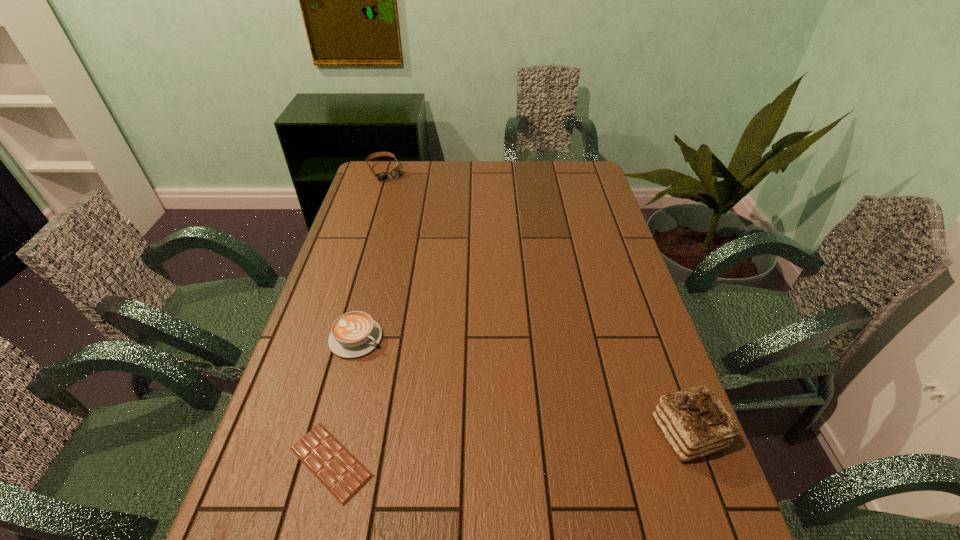
Where is `chocolate bar`? chocolate bar is located at coordinates (343, 475).

The width and height of the screenshot is (960, 540). Identify the location of the rightmost object. (694, 422).

Image resolution: width=960 pixels, height=540 pixels. What are the coordinates of `the tallest object` in the screenshot? It's located at [694, 422].

Where is `the second farthest object`? the second farthest object is located at coordinates (353, 334).

The image size is (960, 540). Find the location of `goggles`. goggles is located at coordinates (396, 172).

Image resolution: width=960 pixels, height=540 pixels. I want to click on vacant area situated on the back of the shortest object, so click(x=372, y=295).

This screenshot has height=540, width=960. Find the location of `vacant space located 0.130m on the back of the tallest object`. vacant space located 0.130m on the back of the tallest object is located at coordinates (660, 358).

At what (x,y) coordinates should I click in order to perform the action: click on blank space located 0.340m on the side of the cappuccino with the handle. Please return your answer as a coordinate pair (x, y). This screenshot has height=540, width=960. Looking at the image, I should click on (491, 413).

Where is `free region located on the side of the cappuccino with the handle`? free region located on the side of the cappuccino with the handle is located at coordinates (506, 421).

This screenshot has height=540, width=960. What are the coordinates of `vacant space located 0.340m on the side of the cappuccino with the handle` in the screenshot? It's located at (491, 413).